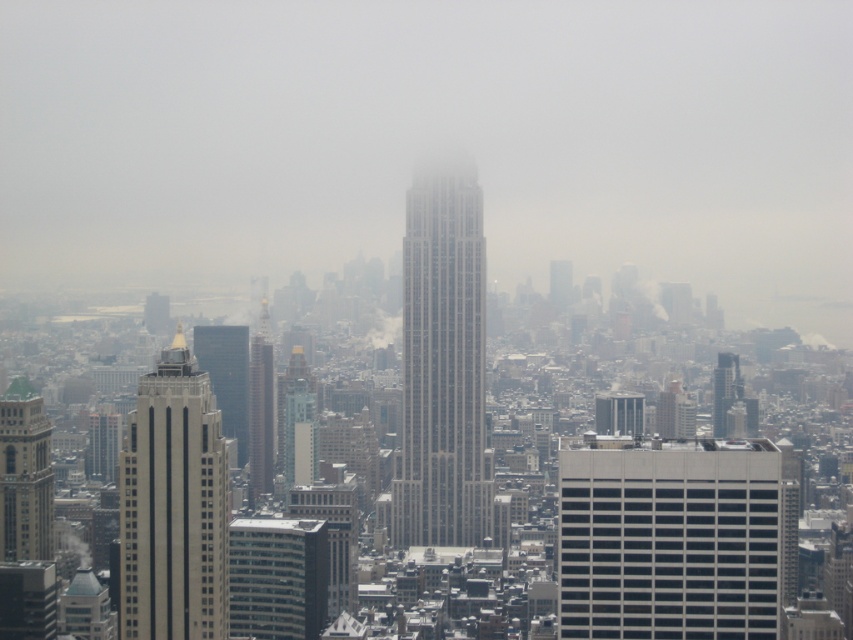
Does light blue glass building at center have a lesser height compared to smooth glass skyscraper at center?

No, light blue glass building at center is not shorter than smooth glass skyscraper at center.

Does light blue glass building at center have a lesser width compared to smooth glass skyscraper at center?

No, light blue glass building at center is not thinner than smooth glass skyscraper at center.

Does point (299, 358) lie in front of point (717, 416)?

Yes, point (299, 358) is in front of point (717, 416).

Where is `light blue glass building at center`? This screenshot has width=853, height=640. light blue glass building at center is located at coordinates (291, 390).

Which of these two, gray concrete building at center-right or gray stone skyscraper at center, stands shorter?

With less height is gray concrete building at center-right.

Between gray concrete building at center-right and gray stone skyscraper at center, which one has more height?

With more height is gray stone skyscraper at center.

Who is more distant from viewer, (x=643, y=525) or (x=419, y=381)?

Point (x=643, y=525)

Find the location of `gray concrete building at center-right`. gray concrete building at center-right is located at coordinates (670, 540).

Is dark gray glass skyscraper at center to the right of smooth glass skyscraper at center from the viewer's perspective?

Incorrect, dark gray glass skyscraper at center is not on the right side of smooth glass skyscraper at center.

Is dark gray glass skyscraper at center below smooth glass skyscraper at center?

Yes.

Which is in front, point (254, 388) or point (717, 433)?

Point (254, 388) is more forward.

Image resolution: width=853 pixels, height=640 pixels. Find the location of `dark gray glass skyscraper at center`. dark gray glass skyscraper at center is located at coordinates (260, 417).